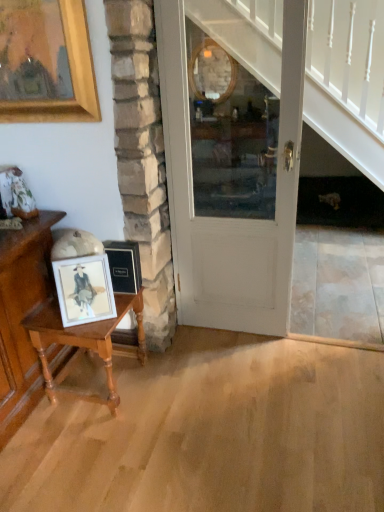
Question: In terms of width, does wooden table at left look wider or thinner when compared to matte wooden picture frame at left?

Choices:
 (A) wide
 (B) thin

Answer: (A)

Question: Based on their positions, is wooden table at left located to the left or right of matte wooden picture frame at left?

Choices:
 (A) right
 (B) left

Answer: (B)

Question: Which object is positioned closest to the matte wooden picture frame at left?

Choices:
 (A) white painted wood door at center
 (B) wooden table at left

Answer: (B)

Question: Considering the real-world distances, which object is farthest from the white painted wood door at center?

Choices:
 (A) wooden table at left
 (B) matte wooden picture frame at left

Answer: (B)